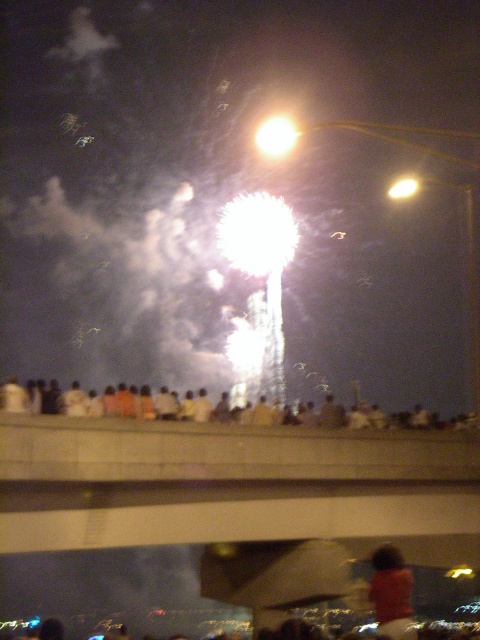
Question: Among these objects, which one is farthest from the camera?

Choices:
 (A) orange fabric shirt at center
 (B) white cotton shirt at lower center

Answer: (B)

Question: Among these points, which one is farthest from the camera?

Choices:
 (A) (383, 596)
 (B) (119, 400)

Answer: (B)

Question: Is white cotton shirt at lower center positioned in front of orange fabric shirt at center?

Choices:
 (A) no
 (B) yes

Answer: (A)

Question: Among these points, which one is farthest from the camera?

Choices:
 (A) (383, 554)
 (B) (155, 416)

Answer: (B)

Question: Does white cotton shirt at lower center appear over orange fabric shirt at center?

Choices:
 (A) no
 (B) yes

Answer: (B)

Question: Considering the relative positions of white cotton shirt at lower center and orange fabric shirt at center in the image provided, where is white cotton shirt at lower center located with respect to orange fabric shirt at center?

Choices:
 (A) right
 (B) left

Answer: (A)